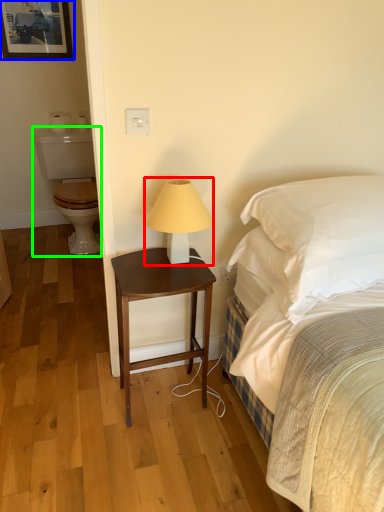
Question: Which object is positioned farthest from table lamp (highlighted by a red box)? Select from picture frame (highlighted by a blue box) and sit (highlighted by a green box).

Choices:
 (A) picture frame
 (B) sit

Answer: (A)